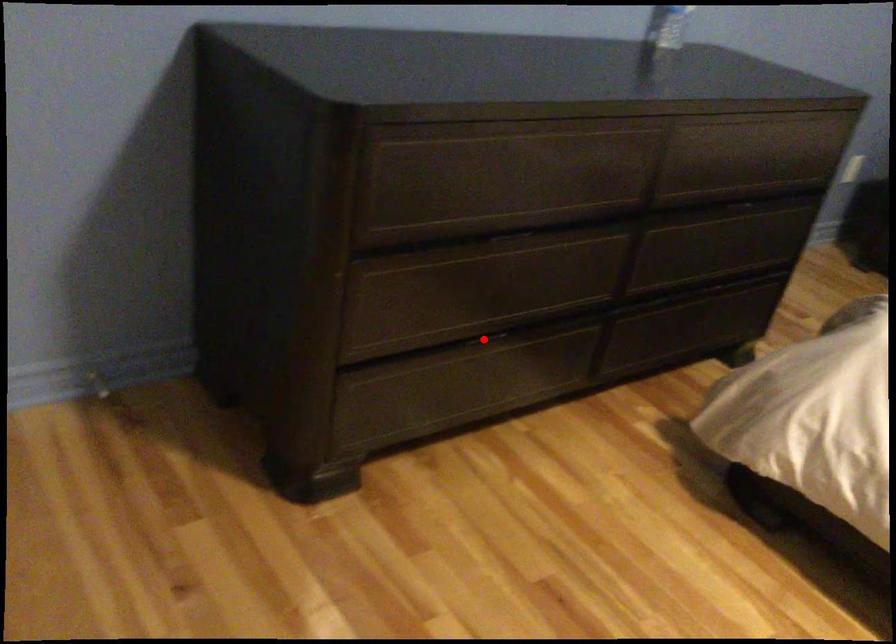
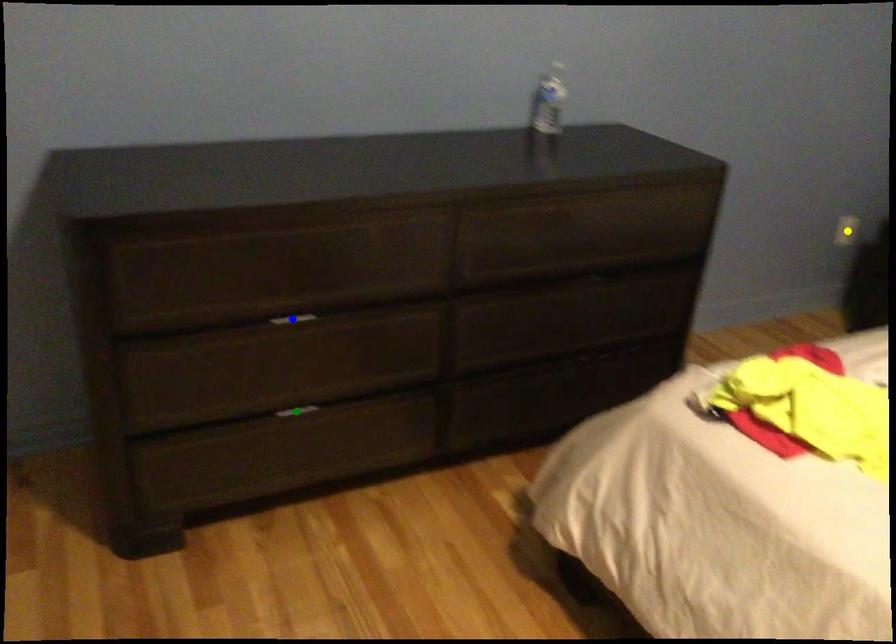
Question: I am providing you with two images of the same scene from different viewpoints. A red point is marked on the first image. You are given multiple points on the second image. Which mark in image 2 goes with the point in image 1?

Choices:
 (A) green point
 (B) blue point
 (C) yellow point

Answer: (A)